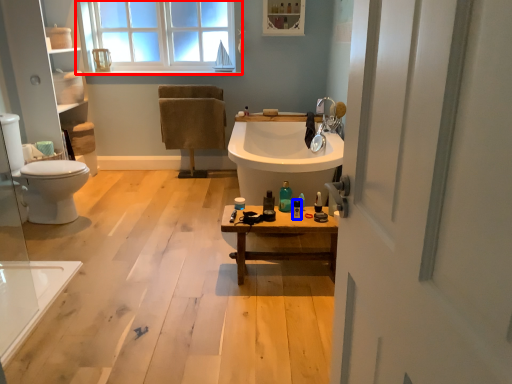
Question: Which object appears closest to the camera in this image, window (highlighted by a red box) or toiletry (highlighted by a blue box)?

Choices:
 (A) window
 (B) toiletry

Answer: (B)